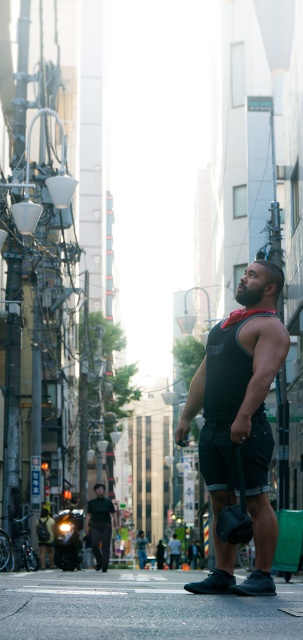
You are a fashion designer observing the urban scene. You need to determine which clothing item is narrower between the black matte tank top at center and the dark green shirt at lower center. Which one is it?

The black matte tank top at center has a lesser width compared to the dark green shirt at lower center, so the black matte tank top at center is narrower.

Looking at this image, you are a fashion designer observing the man in the image. You notice he is wearing two clothing items, the black matte tank top at center and the dark green shirt at lower center. Which clothing item is located more to the right side?

The black matte tank top at center is positioned on the right side of dark green shirt at lower center, so the black matte tank top at center is more to the right side.

Looking at this image, you are a photographer taking a picture of the man in the scene. You want to focus on the black matte tank top at center and the dark green shirt at lower center. Which one will be more visible in your photo?

The black matte tank top at center will be more visible in your photo because it is in front of the dark green shirt at lower center, making it appear closer to the camera and thus more prominent.